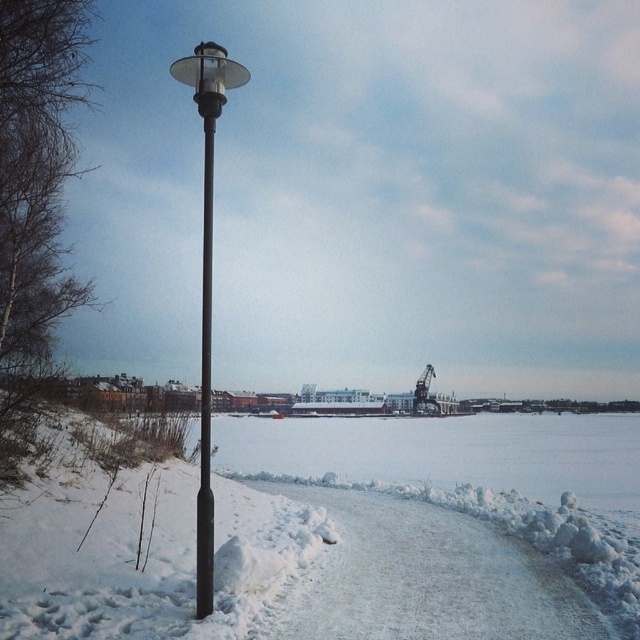
Question: Does white fluffy snow at center appear over black smooth pole at center?

Choices:
 (A) no
 (B) yes

Answer: (A)

Question: Which of the following is the closest to the observer?

Choices:
 (A) white fluffy snow at center
 (B) black smooth pole at center
 (C) black matte pole at center

Answer: (A)

Question: Does black matte pole at center appear under black smooth pole at center?

Choices:
 (A) no
 (B) yes

Answer: (A)

Question: Which of the following is the farthest from the observer?

Choices:
 (A) white fluffy snow at center
 (B) black matte pole at center
 (C) black smooth pole at center

Answer: (C)

Question: Is white fluffy snow at center further to the viewer compared to black smooth pole at center?

Choices:
 (A) no
 (B) yes

Answer: (A)

Question: Which of these objects is positioned closest to the black smooth pole at center?

Choices:
 (A) black matte pole at center
 (B) white fluffy snow at center

Answer: (A)